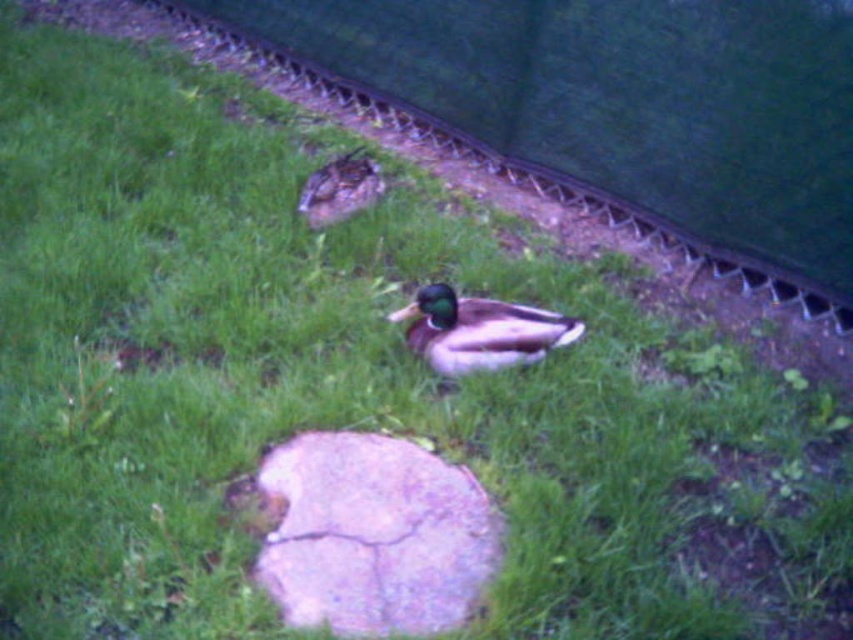
Measure the distance between point (289, 456) and camera.

Point (289, 456) is 3.10 meters away from camera.

Does point (311, 609) lie behind point (569, 321)?

No, (311, 609) is closer to viewer.

Locate an element on the screen. The height and width of the screenshot is (640, 853). purple cracked rock at center is located at coordinates (374, 536).